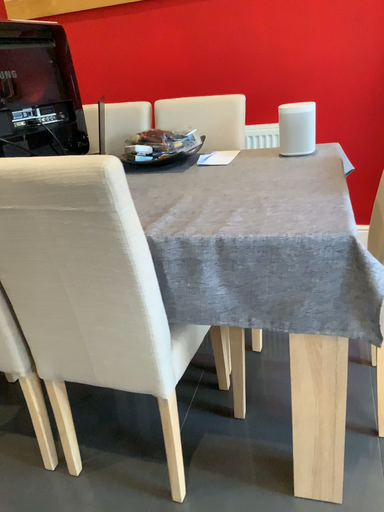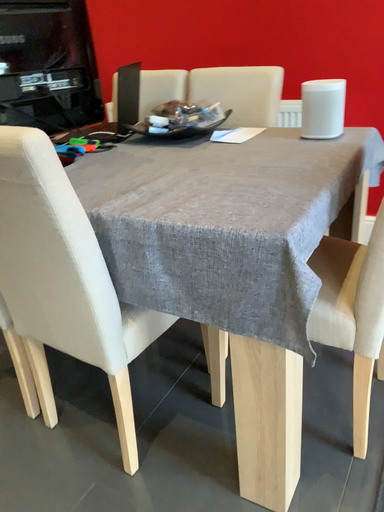
Question: Which way did the camera rotate in the video?

Choices:
 (A) rotated right
 (B) rotated left

Answer: (B)